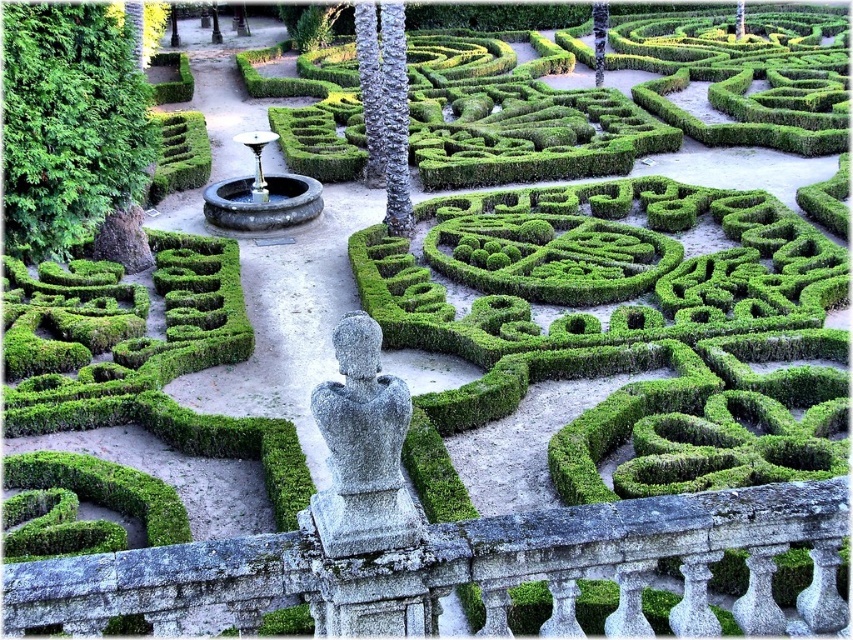
Question: Estimate the real-world distances between objects in this image. Which object is farther from the green leafy bush at left?

Choices:
 (A) black stone fountain at center
 (B) gray stone statue at center

Answer: (B)

Question: Estimate the real-world distances between objects in this image. Which object is closer to the gray stone statue at center?

Choices:
 (A) green leafy bush at left
 (B) black stone fountain at center

Answer: (A)

Question: Is green leafy bush at left wider than gray stone statue at center?

Choices:
 (A) yes
 (B) no

Answer: (A)

Question: Is green leafy bush at left above gray stone statue at center?

Choices:
 (A) yes
 (B) no

Answer: (A)

Question: Which point is closer to the camera?

Choices:
 (A) gray stone statue at center
 (B) black stone fountain at center

Answer: (A)

Question: Does green leafy bush at left have a smaller size compared to black stone fountain at center?

Choices:
 (A) yes
 (B) no

Answer: (B)